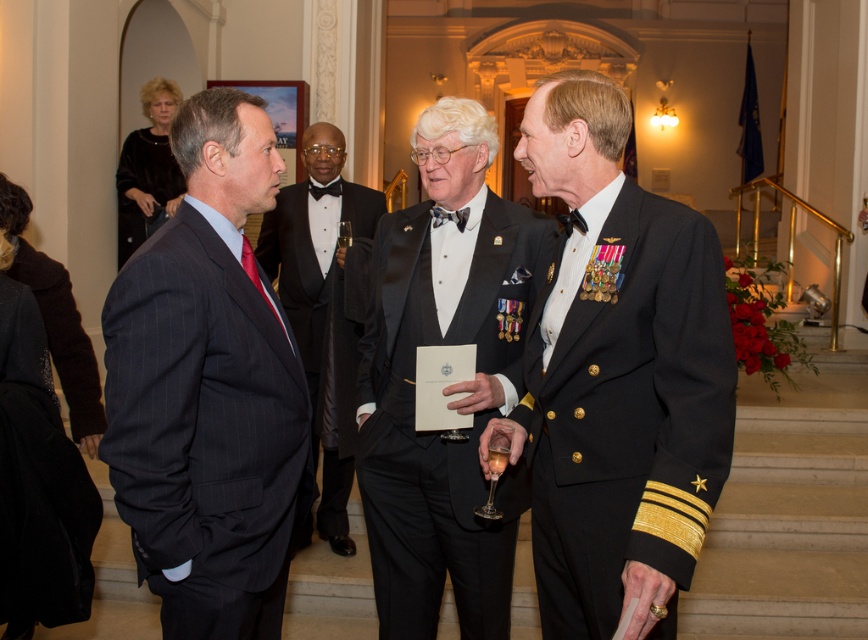
You are a photographer positioned at the entrance of the grand hall. You need to capture a photo of both the shiny black uniform at center and the matte black suit at center. Which one should you focus on first if you want to include both in your frame without moving the camera?

You should focus on the matte black suit at center first because the shiny black uniform at center is to the right of it, so adjusting the camera to include both would require framing from the leftmost object first.